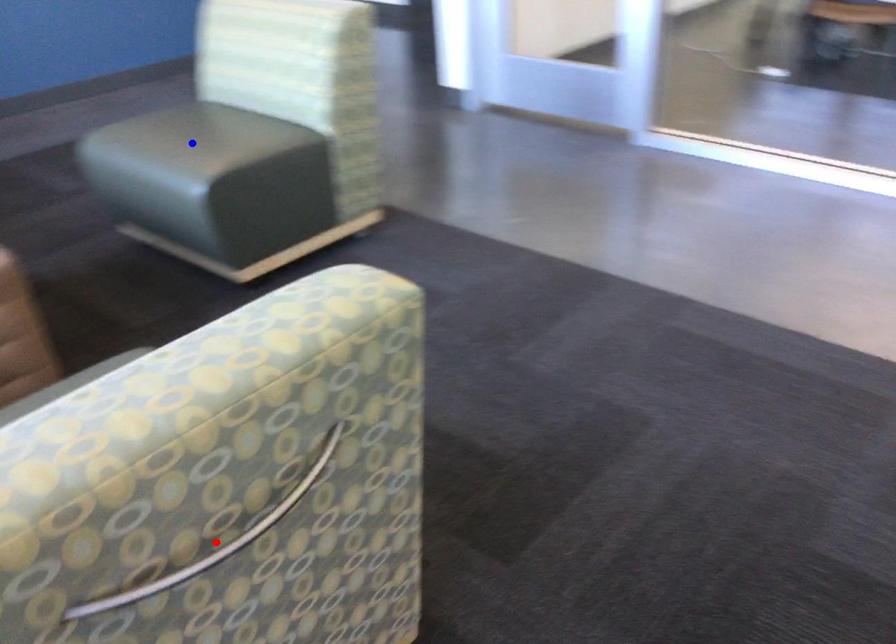
Question: Two points are marked on the image. Which point is closer to the camera?

Choices:
 (A) Blue point is closer.
 (B) Red point is closer.

Answer: (B)